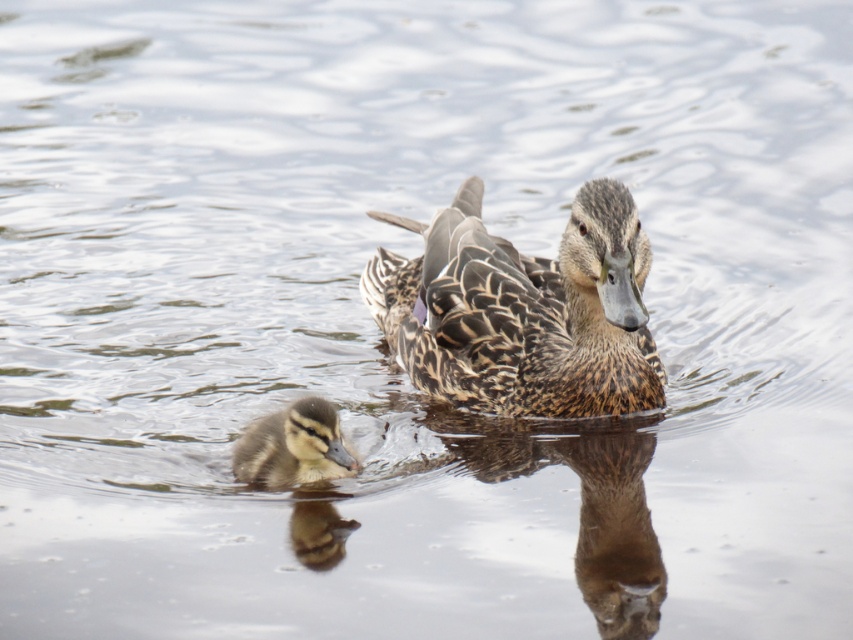
Question: Does speckled feathered duckling at center appear on the right side of brown fuzzy duckling at lower left?

Choices:
 (A) yes
 (B) no

Answer: (A)

Question: Which of the following is the farthest from the observer?

Choices:
 (A) (471, 218)
 (B) (305, 429)

Answer: (A)

Question: Which point is farther to the camera?

Choices:
 (A) speckled feathered duckling at center
 (B) brown fuzzy duckling at lower left

Answer: (A)

Question: Can you confirm if speckled feathered duckling at center is positioned to the right of brown fuzzy duckling at lower left?

Choices:
 (A) yes
 (B) no

Answer: (A)

Question: Can you confirm if speckled feathered duckling at center is smaller than brown fuzzy duckling at lower left?

Choices:
 (A) yes
 (B) no

Answer: (B)